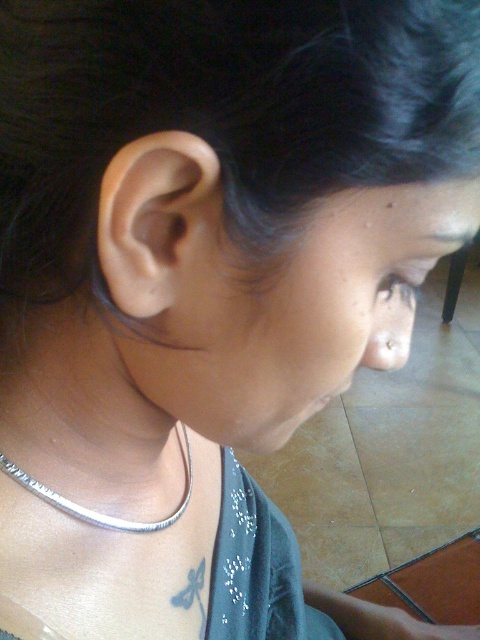
Question: Estimate the real-world distances between objects in this image. Which object is closer to the silver metallic earring at ear?

Choices:
 (A) silver/metallic chain at lower center
 (B) natural skin tone ear at center

Answer: (B)

Question: From the image, what is the correct spatial relationship of silver metallic necklace at center in relation to silver metallic earring at ear?

Choices:
 (A) below
 (B) above

Answer: (A)

Question: Which of the following is the farthest from the observer?

Choices:
 (A) natural skin tone ear at center
 (B) silver metallic necklace at center
 (C) silver metallic earring at ear
 (D) silver/metallic chain at lower center

Answer: (D)

Question: Is silver metallic necklace at center thinner than silver/metallic chain at lower center?

Choices:
 (A) yes
 (B) no

Answer: (A)

Question: Can you confirm if natural skin tone ear at center is thinner than silver metallic earring at ear?

Choices:
 (A) no
 (B) yes

Answer: (A)

Question: Which point is farther to the camera?

Choices:
 (A) (168, 144)
 (B) (107, 355)

Answer: (B)